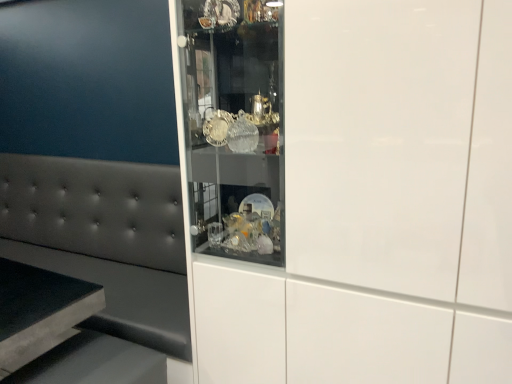
Question: Is matte gray cushion at left next to white glossy cabinet at center and touching it?

Choices:
 (A) yes
 (B) no

Answer: (B)

Question: Would you say white glossy cabinet at center is part of matte gray cushion at left's contents?

Choices:
 (A) no
 (B) yes

Answer: (A)

Question: Does matte gray cushion at left have a lesser height compared to white glossy cabinet at center?

Choices:
 (A) no
 (B) yes

Answer: (B)

Question: Is matte gray cushion at left taller than white glossy cabinet at center?

Choices:
 (A) yes
 (B) no

Answer: (B)

Question: Can you confirm if matte gray cushion at left is thinner than white glossy cabinet at center?

Choices:
 (A) yes
 (B) no

Answer: (A)

Question: From the image's perspective, is matte gray cushion at left beneath white glossy cabinet at center?

Choices:
 (A) no
 (B) yes

Answer: (B)

Question: Considering the relative sizes of white glossy cabinet at center and matte gray cushion at left in the image provided, is white glossy cabinet at center thinner than matte gray cushion at left?

Choices:
 (A) yes
 (B) no

Answer: (B)

Question: Is white glossy cabinet at center to the right of matte gray cushion at left from the viewer's perspective?

Choices:
 (A) no
 (B) yes

Answer: (B)

Question: Is white glossy cabinet at center taller than matte gray cushion at left?

Choices:
 (A) no
 (B) yes

Answer: (B)

Question: Is white glossy cabinet at center positioned in front of matte gray cushion at left?

Choices:
 (A) no
 (B) yes

Answer: (B)

Question: Are white glossy cabinet at center and matte gray cushion at left making contact?

Choices:
 (A) yes
 (B) no

Answer: (B)

Question: Is white glossy cabinet at center facing away from matte gray cushion at left?

Choices:
 (A) yes
 (B) no

Answer: (B)

Question: From the image's perspective, is matte gray cushion at left above or below white glossy cabinet at center?

Choices:
 (A) below
 (B) above

Answer: (A)